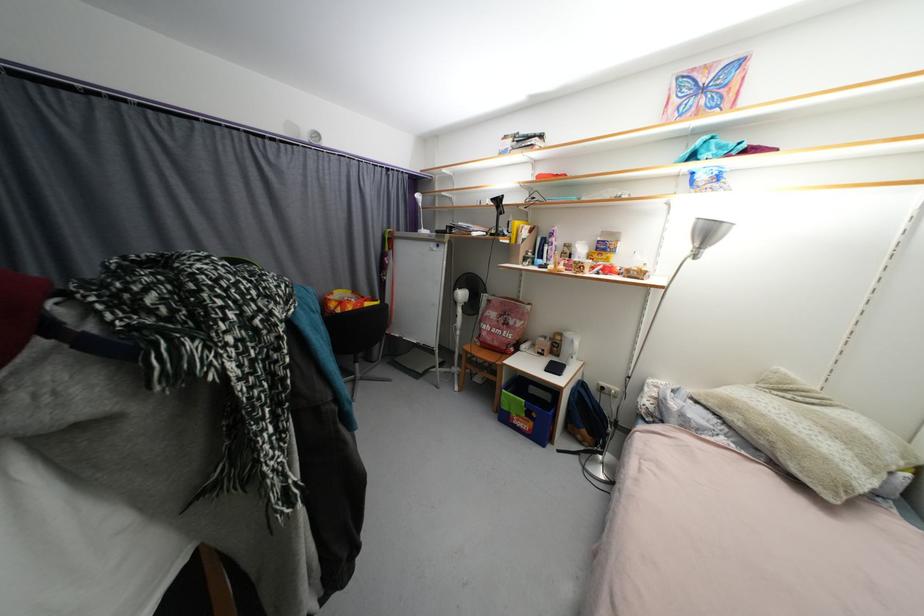
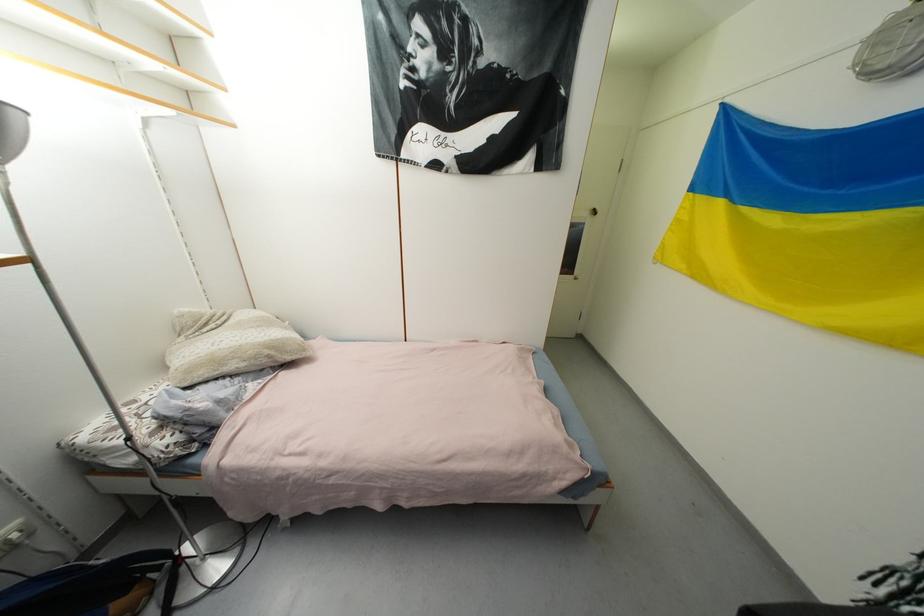
Where in the second image is the point corresponding to (764,434) from the first image?

(261, 359)